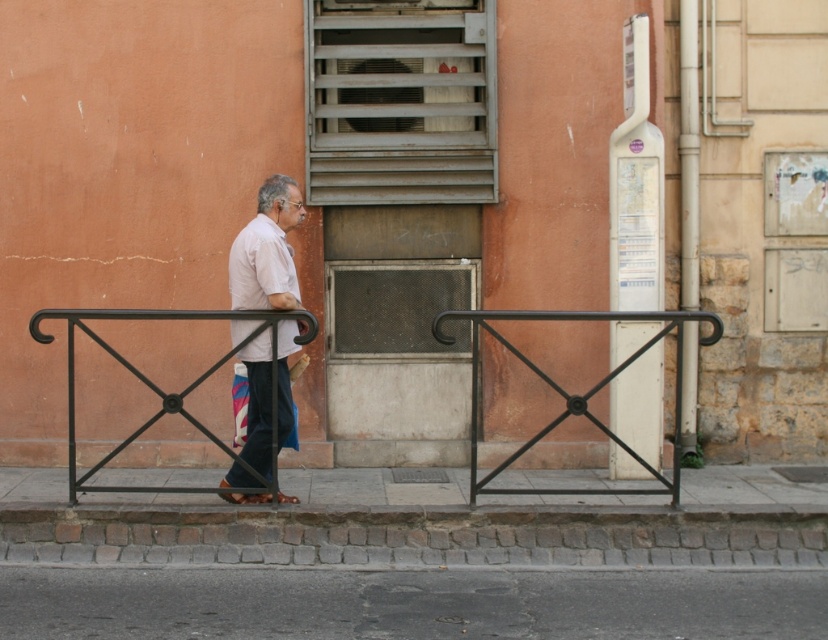
Question: Which point is farther from the camera taking this photo?

Choices:
 (A) (675, 472)
 (B) (262, 278)

Answer: (B)

Question: Which object is the closest to the black metal balustrade at center?

Choices:
 (A) black metal rail at center
 (B) white cotton shirt at center
 (C) gray asphalt at lower center

Answer: (B)

Question: Which of these objects is positioned closest to the black metal balustrade at center?

Choices:
 (A) white cotton shirt at center
 (B) gray asphalt at lower center

Answer: (A)

Question: Is white cotton shirt at center positioned before black metal balustrade at center?

Choices:
 (A) yes
 (B) no

Answer: (B)

Question: Is the position of gray asphalt at lower center less distant than that of white cotton shirt at center?

Choices:
 (A) yes
 (B) no

Answer: (A)

Question: Can you confirm if gray asphalt at lower center is positioned above black metal rail at center?

Choices:
 (A) no
 (B) yes

Answer: (A)